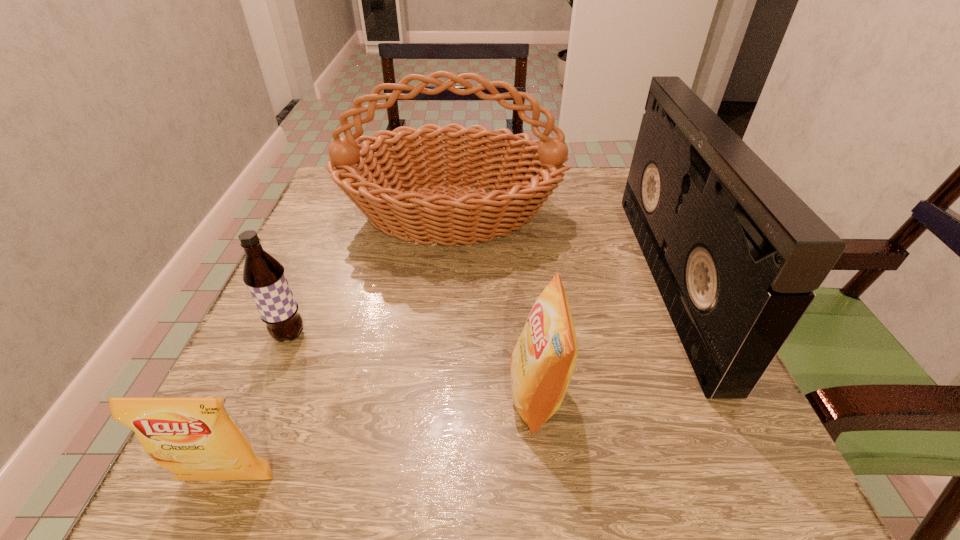
This screenshot has width=960, height=540. In order to click on object at the right edge in this screenshot , I will do `click(736, 254)`.

Where is `object present at the far left corner`? Image resolution: width=960 pixels, height=540 pixels. object present at the far left corner is located at coordinates (395, 197).

This screenshot has width=960, height=540. I want to click on object present at the near left corner, so click(196, 438).

Locate an element on the screen. The width and height of the screenshot is (960, 540). object situated at the far right corner is located at coordinates (736, 254).

In the image, there is a desktop. At what (x,y) coordinates should I click in order to perform the action: click on free space at the near edge. Please return your answer as a coordinate pair (x, y). The image size is (960, 540). Looking at the image, I should click on (492, 470).

Identify the location of free region at the left edge of the desktop. The height and width of the screenshot is (540, 960). (255, 377).

At what (x,y) coordinates should I click in order to perform the action: click on vacant area at the right edge of the desktop. Please return your answer as a coordinate pair (x, y). The height and width of the screenshot is (540, 960). Looking at the image, I should click on (741, 409).

Locate an element on the screen. This screenshot has width=960, height=540. vacant space at the far left corner of the desktop is located at coordinates (340, 195).

Where is `vacant space at the near left corner of the desktop`? vacant space at the near left corner of the desktop is located at coordinates (293, 485).

Locate an element on the screen. The height and width of the screenshot is (540, 960). free area in between the farther crisp (potato chip) and the root beer is located at coordinates click(414, 364).